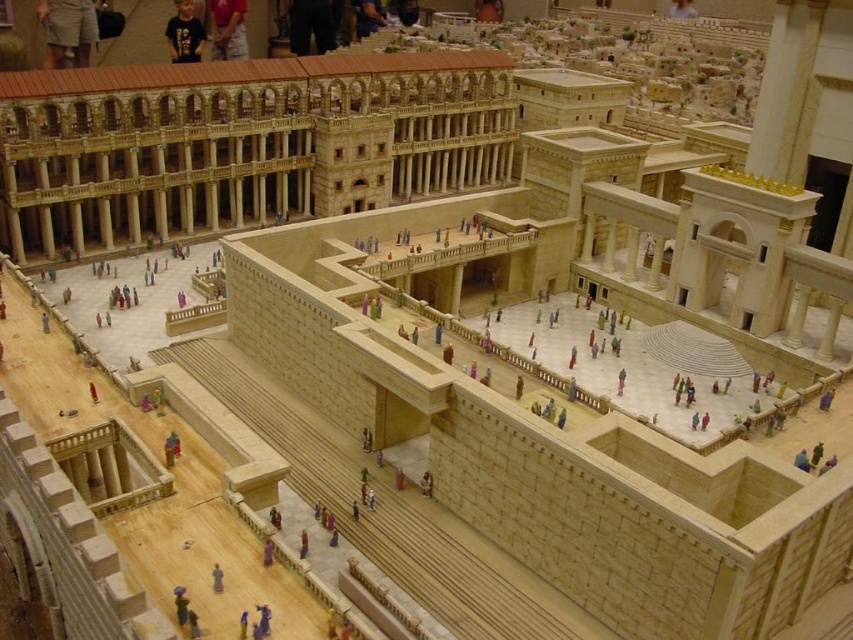
Question: Estimate the real-world distances between objects in this image. Which object is farther from the gray fabric figure at center?

Choices:
 (A) khaki shorts at upper left
 (B) purple fabric person at lower center

Answer: (A)

Question: Which point is farther to the camera?

Choices:
 (A) purple fabric person at lower center
 (B) dark blue shirt at upper center

Answer: (B)

Question: Estimate the real-world distances between objects in this image. Which object is farther from the khaki shorts at upper left?

Choices:
 (A) black t-shirt at upper center
 (B) gray fabric figure at center
 (C) purple fabric person at lower center

Answer: (B)

Question: Does gray fabric figure at center have a larger size compared to purple fabric person at lower center?

Choices:
 (A) no
 (B) yes

Answer: (A)

Question: In this image, where is khaki shorts at upper left located relative to dark blue shirt at upper center?

Choices:
 (A) above
 (B) below

Answer: (B)

Question: Is black t-shirt at upper center to the right of gray fabric figure at center from the viewer's perspective?

Choices:
 (A) no
 (B) yes

Answer: (A)